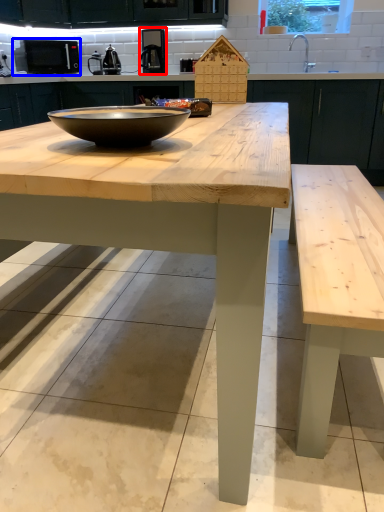
Question: Which of the following is the farthest to the observer, coffee machine (highlighted by a red box) or appliance (highlighted by a blue box)?

Choices:
 (A) coffee machine
 (B) appliance

Answer: (B)